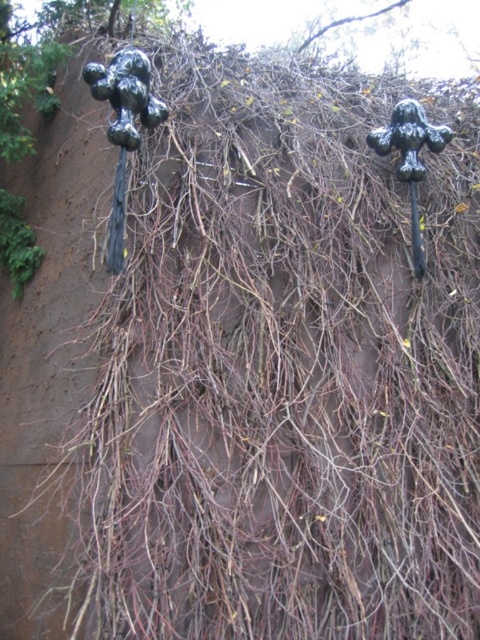
Does glossy black sculpture at upper left have a greater height compared to black matte sculpture at right?

In fact, glossy black sculpture at upper left may be shorter than black matte sculpture at right.

Is glossy black sculpture at upper left to the right of black matte sculpture at right from the viewer's perspective?

No, glossy black sculpture at upper left is not to the right of black matte sculpture at right.

Which is behind, point (115, 64) or point (408, 170)?

The point (408, 170) is more distant.

Locate an element on the screen. Image resolution: width=480 pixels, height=640 pixels. glossy black sculpture at upper left is located at coordinates (126, 93).